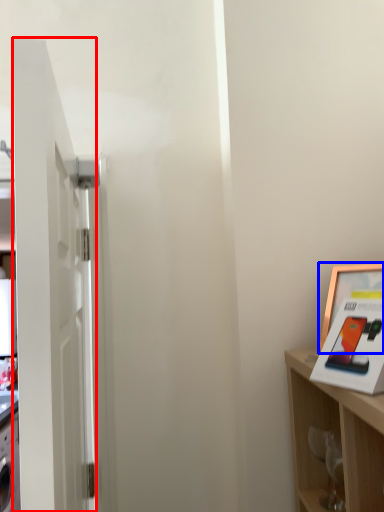
Question: Which object is further to the camera taking this photo, door (highlighted by a red box) or picture frame (highlighted by a blue box)?

Choices:
 (A) door
 (B) picture frame

Answer: (B)